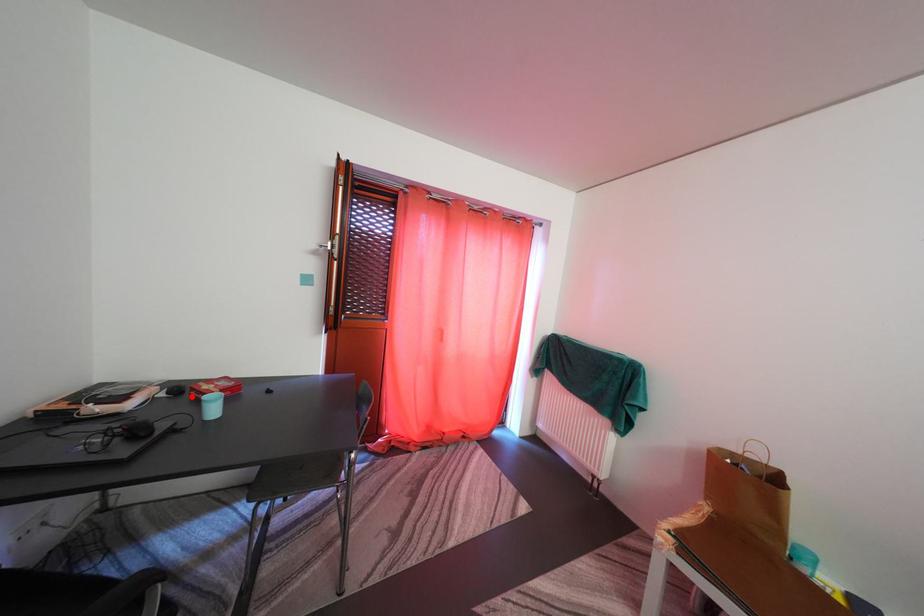
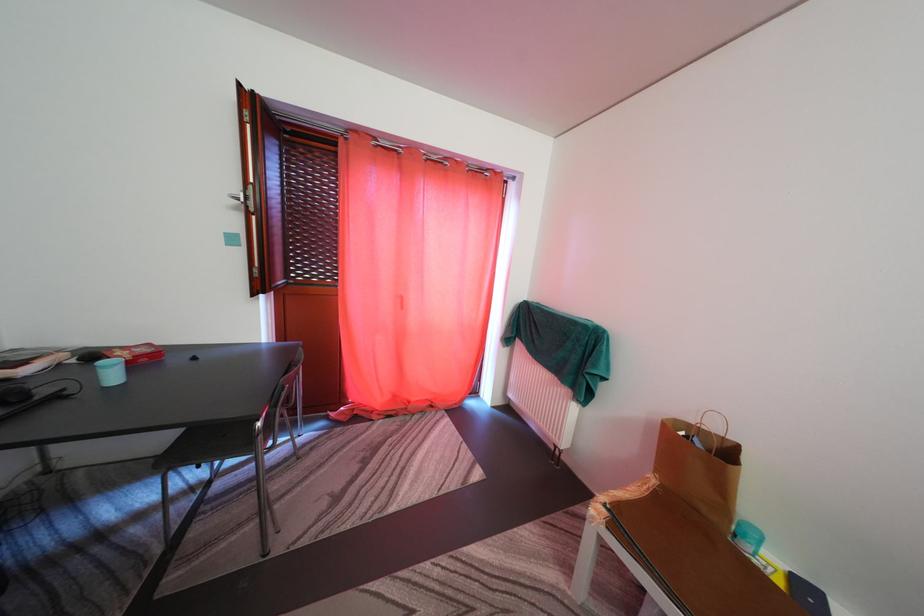
In the second image, find the point that corresponds to the highlighted location in the first image.

(102, 362)